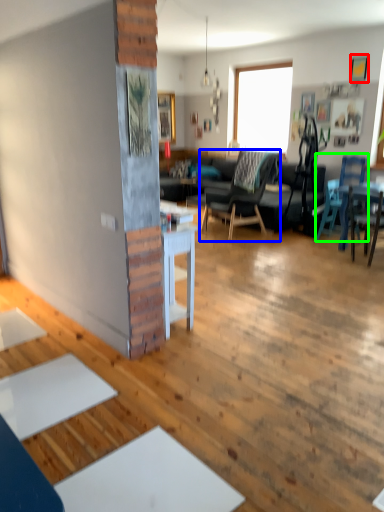
Question: Which object is the farthest from picture frame (highlighted by a red box)? Choose among these: chair (highlighted by a blue box) or chair (highlighted by a green box).

Choices:
 (A) chair
 (B) chair

Answer: (A)